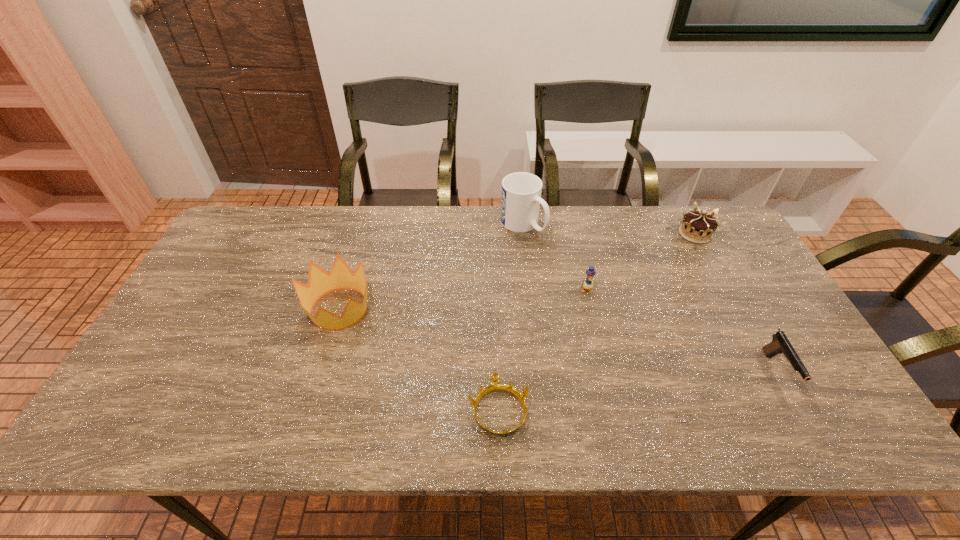
Find the location of a particular element. The height and width of the screenshot is (540, 960). blank region between the duckling and the pistol is located at coordinates (682, 330).

Locate an element on the screen. The width and height of the screenshot is (960, 540). unoccupied area between the nearest crown and the pistol is located at coordinates (638, 391).

Where is `vacant space in between the mug and the tallest crown`? The width and height of the screenshot is (960, 540). vacant space in between the mug and the tallest crown is located at coordinates (431, 267).

The width and height of the screenshot is (960, 540). Find the location of `empty location between the mug and the leftmost crown`. empty location between the mug and the leftmost crown is located at coordinates (431, 267).

In order to click on empty space between the shortest object and the leftmost crown in this screenshot , I will do `click(420, 360)`.

Locate an element on the screen. This screenshot has width=960, height=540. empty location between the nearest crown and the duckling is located at coordinates (542, 350).

Locate which object is the third closest to the leftmost crown. Please provide its 2D coordinates. Your answer should be formatted as a tuple, i.e. [(x, y)], where the tuple contains the x and y coordinates of a point satisfying the conditions above.

[(590, 272)]

Locate which object is the third closest to the third object from right to left. Please provide its 2D coordinates. Your answer should be formatted as a tuple, i.e. [(x, y)], where the tuple contains the x and y coordinates of a point satisfying the conditions above.

[(698, 226)]

Identify which crown is the closest to the tallest object. Please provide its 2D coordinates. Your answer should be formatted as a tuple, i.e. [(x, y)], where the tuple contains the x and y coordinates of a point satisfying the conditions above.

[(320, 282)]

Select which crown is the closest to the nearest crown. Please provide its 2D coordinates. Your answer should be formatted as a tuple, i.e. [(x, y)], where the tuple contains the x and y coordinates of a point satisfying the conditions above.

[(320, 282)]